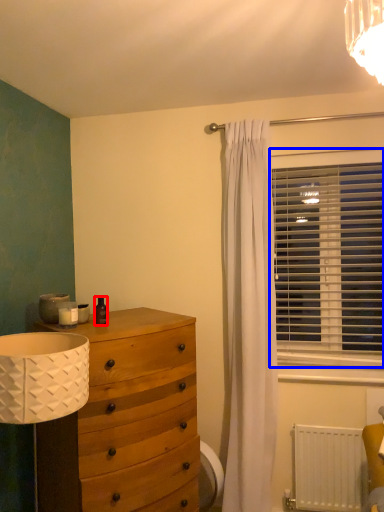
Question: Which object appears farthest to the camera in this image, toiletry (highlighted by a red box) or window blind (highlighted by a blue box)?

Choices:
 (A) toiletry
 (B) window blind

Answer: (B)